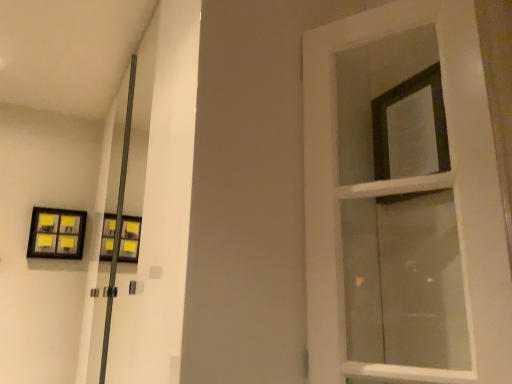
Question: Does black matte frame at upper right appear on the right side of matte black picture frame at upper left?

Choices:
 (A) yes
 (B) no

Answer: (A)

Question: From the image's perspective, is black matte frame at upper right over matte black picture frame at upper left?

Choices:
 (A) no
 (B) yes

Answer: (B)

Question: Are black matte frame at upper right and matte black picture frame at upper left far apart?

Choices:
 (A) yes
 (B) no

Answer: (A)

Question: Does black matte frame at upper right have a greater height compared to matte black picture frame at upper left?

Choices:
 (A) no
 (B) yes

Answer: (B)

Question: Is black matte frame at upper right oriented towards matte black picture frame at upper left?

Choices:
 (A) yes
 (B) no

Answer: (B)

Question: Is black matte frame at upper right facing away from matte black picture frame at upper left?

Choices:
 (A) no
 (B) yes

Answer: (A)

Question: Is black matte frame at upper right looking in the opposite direction of white wooden door at right?

Choices:
 (A) yes
 (B) no

Answer: (B)

Question: Is black matte frame at upper right bigger than white wooden door at right?

Choices:
 (A) yes
 (B) no

Answer: (B)

Question: Does black matte frame at upper right lie behind white wooden door at right?

Choices:
 (A) no
 (B) yes

Answer: (B)

Question: Is black matte frame at upper right to the left of white wooden door at right from the viewer's perspective?

Choices:
 (A) no
 (B) yes

Answer: (A)

Question: Is black matte frame at upper right not within white wooden door at right?

Choices:
 (A) yes
 (B) no

Answer: (A)

Question: Does black matte frame at upper right have a greater width compared to white wooden door at right?

Choices:
 (A) no
 (B) yes

Answer: (B)

Question: From a real-world perspective, does matte black picture frame at upper left stand above white wooden door at right?

Choices:
 (A) no
 (B) yes

Answer: (B)